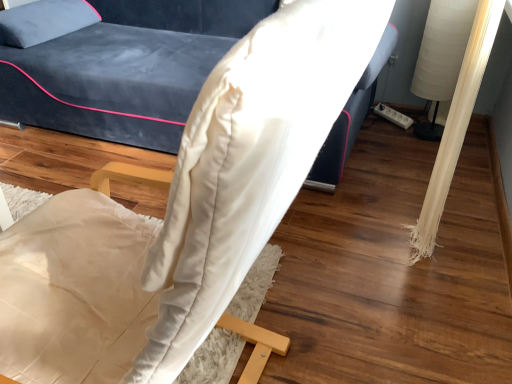
The height and width of the screenshot is (384, 512). Describe the element at coordinates (456, 125) in the screenshot. I see `white textured curtain at lower right` at that location.

Locate an element on the screen. This screenshot has width=512, height=384. white textured curtain at lower right is located at coordinates (456, 125).

Locate an element on the screen. white textured curtain at lower right is located at coordinates (456, 125).